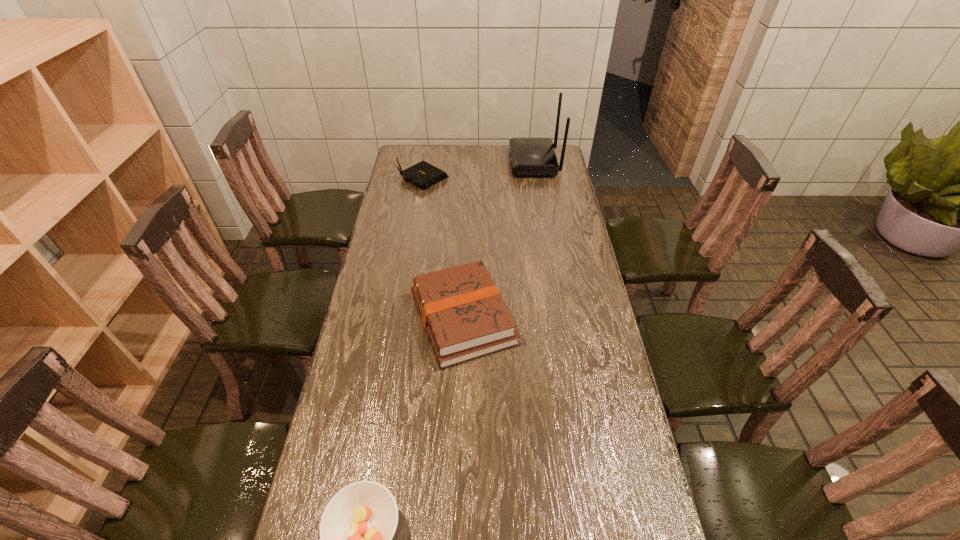
This screenshot has width=960, height=540. I want to click on object situated at the right edge, so click(x=529, y=156).

Where is `object at the far left corner`? object at the far left corner is located at coordinates (422, 174).

The width and height of the screenshot is (960, 540). I want to click on object at the far right corner, so [x=529, y=156].

The height and width of the screenshot is (540, 960). In the image, there is a desktop. Identify the location of vacant space at the far edge. tap(485, 146).

Where is `vacant space at the left edge`? Image resolution: width=960 pixels, height=540 pixels. vacant space at the left edge is located at coordinates (356, 330).

This screenshot has height=540, width=960. In order to click on free space at the right edge in this screenshot , I will do `click(616, 484)`.

Where is `unoccupied area between the third farthest object and the tallest object`? The image size is (960, 540). unoccupied area between the third farthest object and the tallest object is located at coordinates (498, 240).

Where is `vacant area between the shorter router and the tallest object`? The width and height of the screenshot is (960, 540). vacant area between the shorter router and the tallest object is located at coordinates (479, 170).

The width and height of the screenshot is (960, 540). What are the coordinates of `unoccupied position between the third farthest object and the left router` in the screenshot? It's located at (443, 248).

This screenshot has width=960, height=540. In order to click on free space between the left router and the taller router in this screenshot , I will do tap(479, 170).